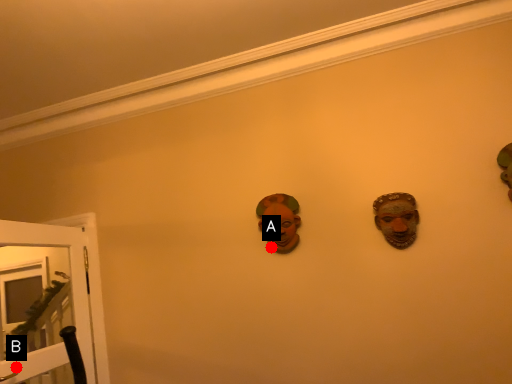
Question: Two points are circled on the image, labeled by A and B beside each circle. Which point is closer to the camera?

Choices:
 (A) A is closer
 (B) B is closer

Answer: (B)